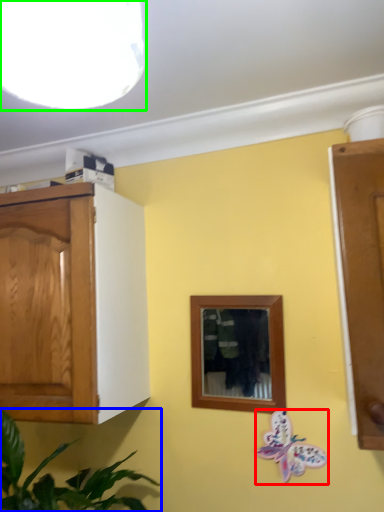
Question: Estimate the real-world distances between objects in this image. Which object is closer to butterfly (highlighted by a red box), houseplant (highlighted by a blue box) or light fixture (highlighted by a green box)?

Choices:
 (A) houseplant
 (B) light fixture

Answer: (A)